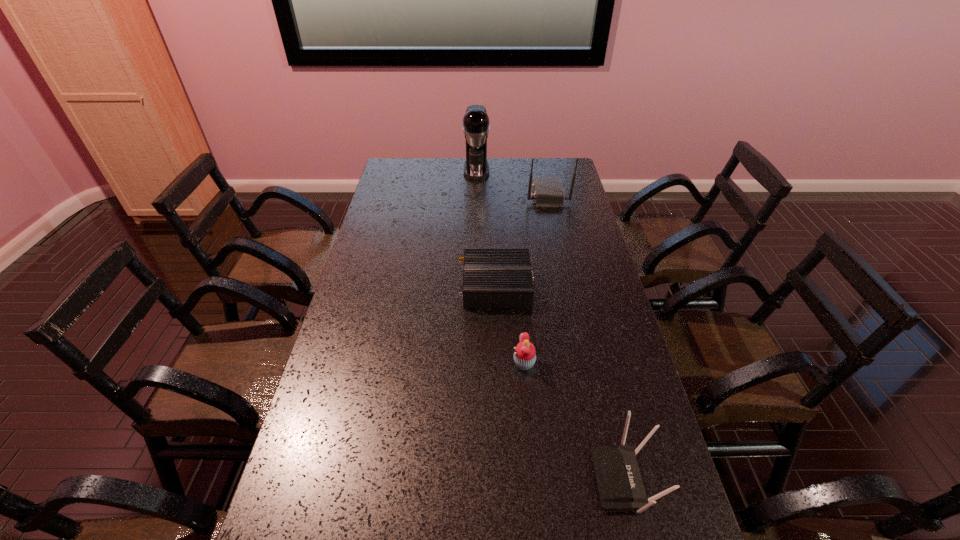
I want to click on free space between the nearest router and the leftmost router, so click(x=561, y=382).

Find the location of a particular element. The image size is (960, 540). vacant region between the fourth nearest object and the shortest router is located at coordinates (521, 241).

You are a GUI agent. You are given a task and a screenshot of the screen. Output one action in this format:
    pyautogui.click(x=<x>, y=<y>)
    Task: Click on the free space between the fourth nearest object and the shortest router
    
    Given the screenshot: What is the action you would take?
    pyautogui.click(x=521, y=241)

Identify the location of free space between the cupcake and the shortest router. (510, 325).

The width and height of the screenshot is (960, 540). I want to click on free space between the second farthest object and the second farthest router, so click(x=521, y=241).

I want to click on object that ranks as the second closest to the cupcake, so click(x=620, y=486).

The height and width of the screenshot is (540, 960). I want to click on object that stands as the closest to the second farthest object, so point(476,127).

Find the location of a particular element. The image size is (960, 540). router that is the second closest to the second farthest router is located at coordinates (620, 486).

Where is `router that is the second closest one to the third nearest object`? router that is the second closest one to the third nearest object is located at coordinates (620, 486).